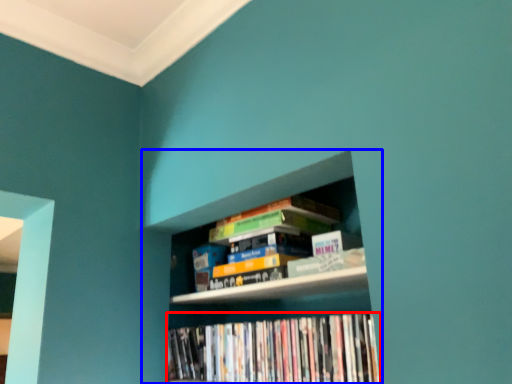
Question: Which of the following is the closest to the observer, book (highlighted by a red box) or bookcase (highlighted by a blue box)?

Choices:
 (A) book
 (B) bookcase

Answer: (B)